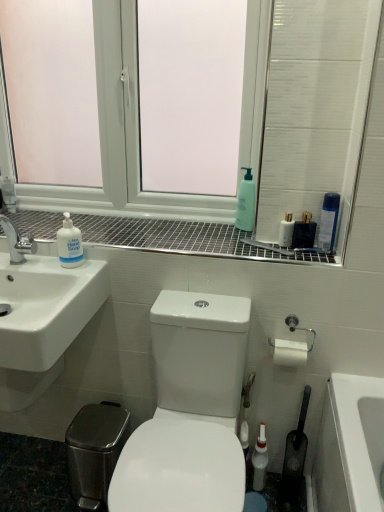
Locate an element on the screen. This screenshot has width=384, height=512. vacant space that is to the left of clear plastic spray bottle at upper right, which appears as the first cleaning product when viewed from the right is located at coordinates click(x=271, y=253).